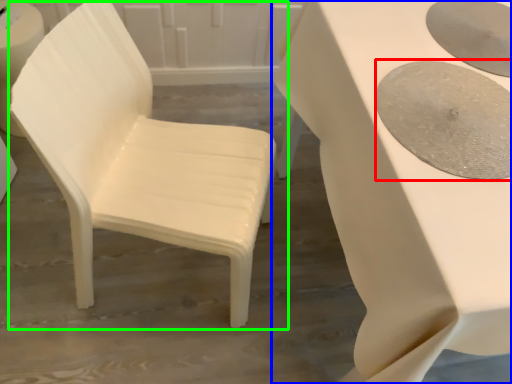
Question: Which object is the farthest from oval (highlighted by a red box)? Choose among these: table (highlighted by a blue box) or chair (highlighted by a green box).

Choices:
 (A) table
 (B) chair

Answer: (B)